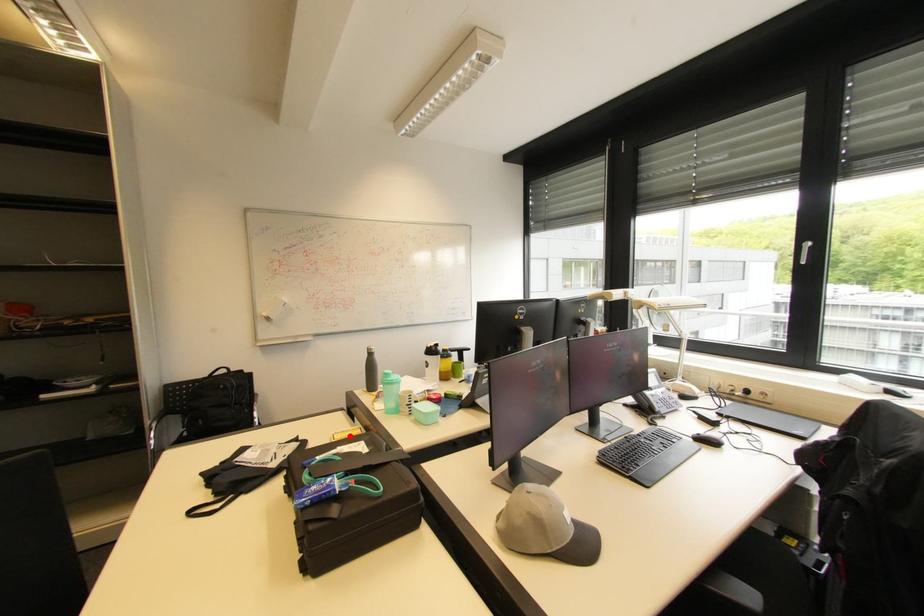
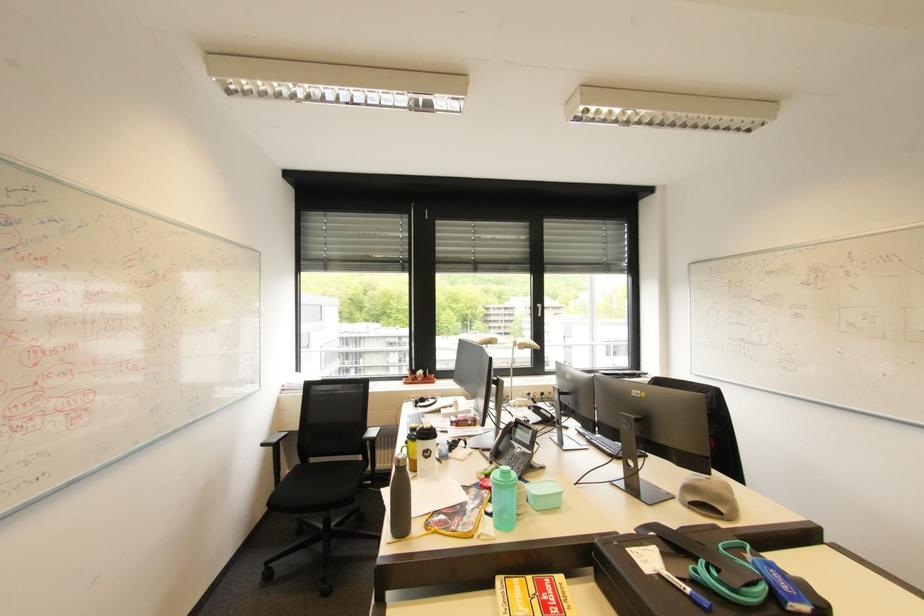
In the second image, find the point that corresponds to the highlighted location in the first image.

(526, 602)